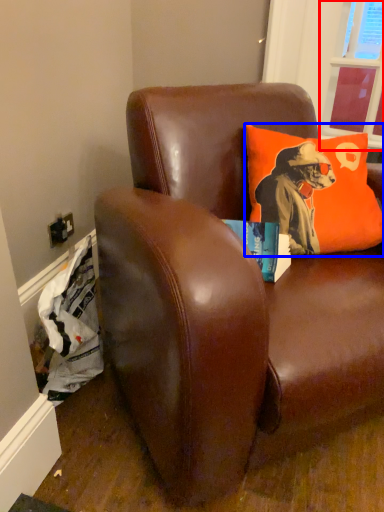
Question: Among these objects, which one is nearest to the camera, window screen (highlighted by a red box) or pillow (highlighted by a blue box)?

Choices:
 (A) window screen
 (B) pillow

Answer: (B)